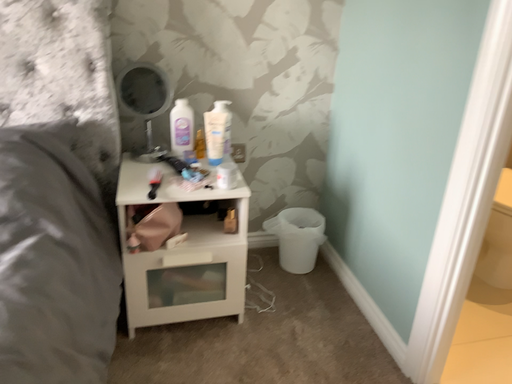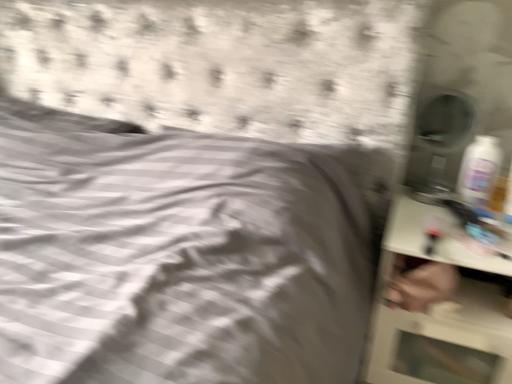
Question: Which way did the camera rotate in the video?

Choices:
 (A) rotated left
 (B) rotated right

Answer: (A)